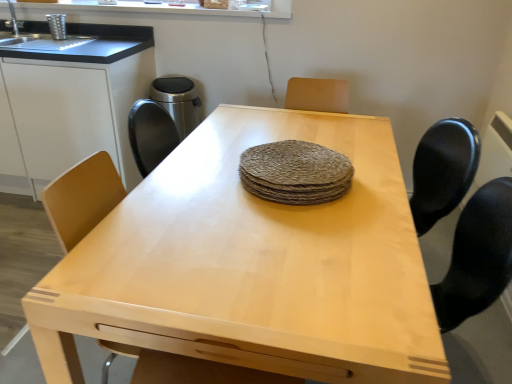
I want to click on free point behind rough woven placemat at center, so click(280, 138).